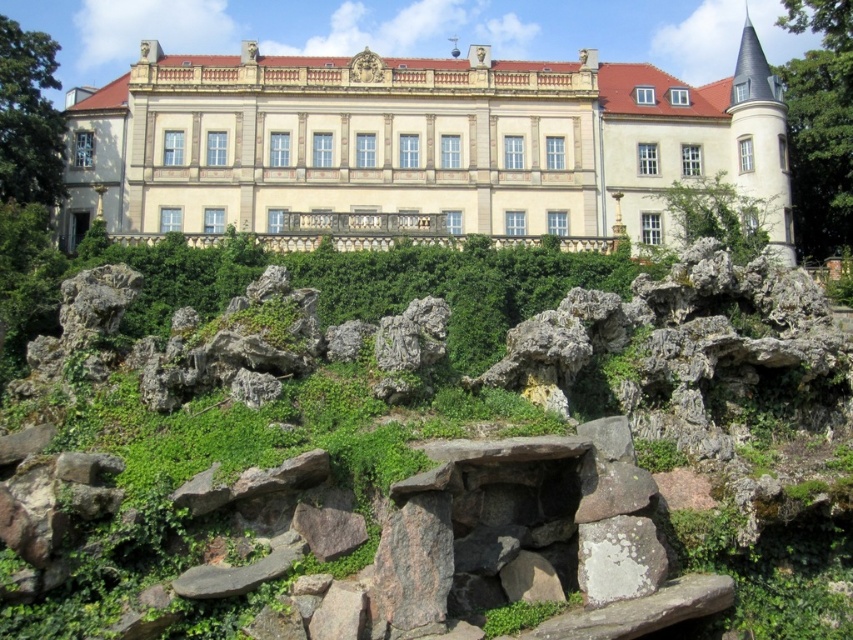
Question: In this image, where is green mossy rocks at center located relative to beige stone palace at center?

Choices:
 (A) below
 (B) above

Answer: (A)

Question: Which of the following is the farthest from the observer?

Choices:
 (A) white lichen-covered rock at center
 (B) green mossy rocks at center
 (C) beige stone palace at center

Answer: (C)

Question: Does green mossy rocks at center appear on the left side of white lichen-covered rock at center?

Choices:
 (A) yes
 (B) no

Answer: (A)

Question: Which point is farther to the camera?

Choices:
 (A) (109, 321)
 (B) (770, 128)

Answer: (B)

Question: Among these points, which one is nearest to the camera?

Choices:
 (A) (225, 68)
 (B) (560, 582)

Answer: (B)

Question: Does beige stone palace at center appear over white lichen-covered rock at center?

Choices:
 (A) yes
 (B) no

Answer: (A)